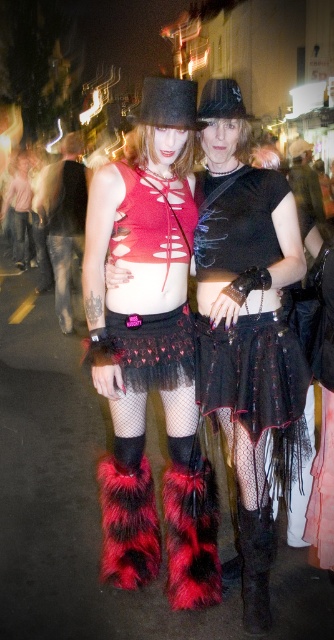
Describe the element at coordinates (150, 353) in the screenshot. This screenshot has height=640, width=334. I see `fuzzy fur boots at lower center` at that location.

Does fuzzy fur boots at lower center lie behind black suede boot at lower center?

No, fuzzy fur boots at lower center is closer to the viewer.

Between point (193, 108) and point (250, 563), which one is positioned in front?

Point (193, 108) is more forward.

At what (x,y) coordinates should I click in order to perform the action: click on fuzzy fur boots at lower center. Please return your answer as a coordinate pair (x, y). The image size is (334, 640). Looking at the image, I should click on (150, 353).

Between fuzzy fur boots at lower center and black sequined skirt at center, which one has more height?

Standing taller between the two is black sequined skirt at center.

Is the position of fuzzy fur boots at lower center more distant than that of black sequined skirt at center?

That is True.

Measure the distance between fuzzy fur boots at lower center and camera.

fuzzy fur boots at lower center is 6.96 feet from camera.

Find the location of a particular element. The image size is (334, 640). fuzzy fur boots at lower center is located at coordinates (150, 353).

Can you confirm if black mesh skirt at center is taller than black suede boot at lower center?

In fact, black mesh skirt at center may be shorter than black suede boot at lower center.

Does black mesh skirt at center have a smaller size compared to black suede boot at lower center?

Actually, black mesh skirt at center might be larger than black suede boot at lower center.

Is point (150, 362) behind point (254, 593)?

Yes.

Where is `black mesh skirt at center`? Image resolution: width=334 pixels, height=640 pixels. black mesh skirt at center is located at coordinates (148, 348).